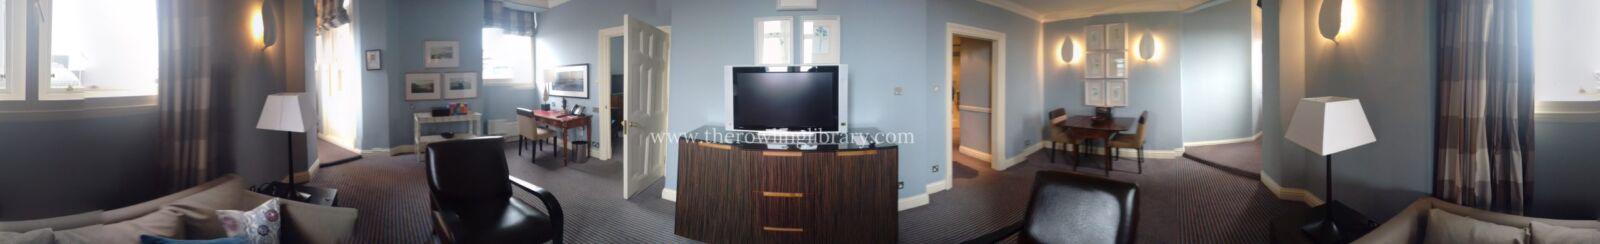
Where is `windows`? The image size is (1600, 244). windows is located at coordinates (107, 47), (496, 54), (1560, 57).